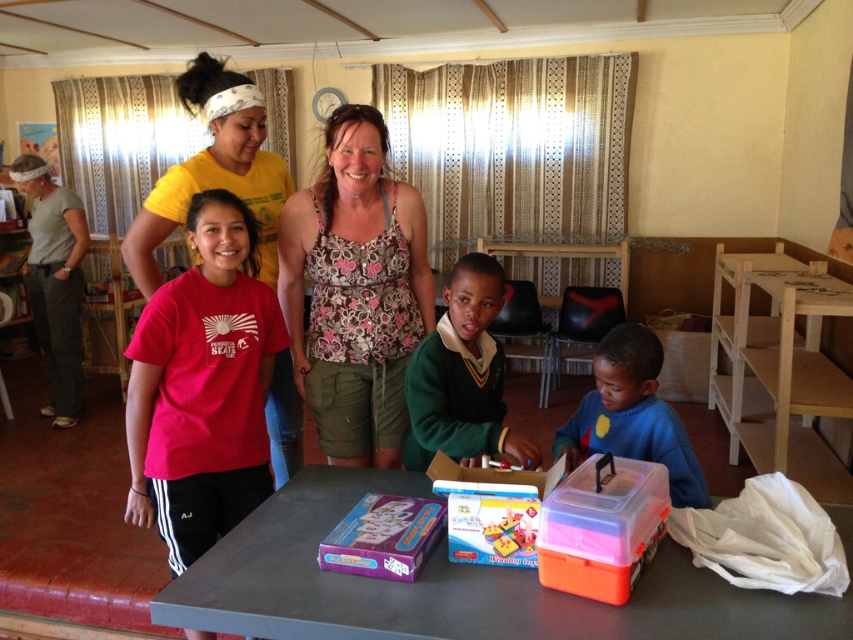
You are a visitor entering the room and want to approach the metallic gray table at center. From your current position near the matte gray pants at left, which direction should you move to reach the table?

The metallic gray table at center is in front of the matte gray pants at left, so you should move forward from the matte gray pants at left to reach the table.

You are standing at the entrance of the room and want to move towards the metallic gray table at center. What direction should you move in?

Since the metallic gray table at center is located at point 0.916 on the x axis and 0.532 on the y axis, you should move forward towards the center of the room to reach it.